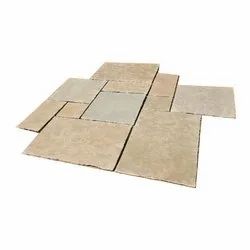
Find the location of a particular element. The height and width of the screenshot is (250, 250). square shaped tiles is located at coordinates (115, 116), (76, 85), (161, 103), (71, 111), (204, 100), (248, 240).